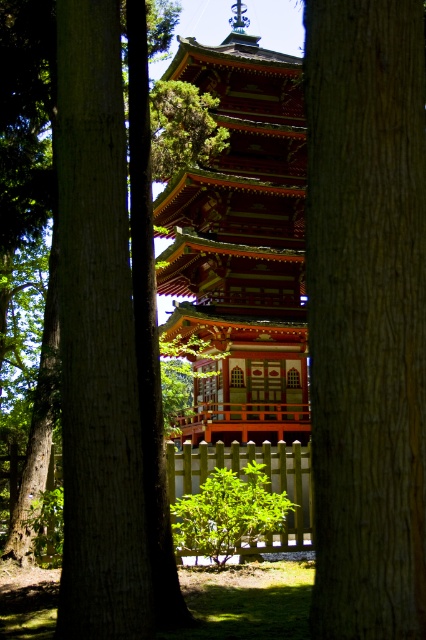
Which of these two, brown rough tree trunk at center or shiny lacquered pagoda at center, stands taller?

Standing taller between the two is shiny lacquered pagoda at center.

Does point (406, 321) come behind point (261, 77)?

No, (406, 321) is closer to viewer.

Is point (351, 620) less distant than point (261, 100)?

Yes, point (351, 620) is closer to viewer.

You are a GUI agent. You are given a task and a screenshot of the screen. Output one action in this format:
    pyautogui.click(x=<x>, y=<y>)
    Task: Click on the brown rough tree trunk at center
    
    Given the screenshot: What is the action you would take?
    pyautogui.click(x=365, y=314)

Is brown rough tree trunk at center shorter than smooth brown tree trunk at center?

Indeed, brown rough tree trunk at center has a lesser height compared to smooth brown tree trunk at center.

Does brown rough tree trunk at center have a greater height compared to smooth brown tree trunk at center?

No.

Is point (307, 296) positioned behind point (71, 484)?

No, (307, 296) is in front of (71, 484).

What are the coordinates of `brown rough tree trunk at center` in the screenshot? It's located at (365, 314).

Does smooth brown tree trunk at center have a greater height compared to shiny lacquered pagoda at center?

Incorrect, smooth brown tree trunk at center's height is not larger of shiny lacquered pagoda at center's.

Between smooth brown tree trunk at center and shiny lacquered pagoda at center, which one is positioned lower?

smooth brown tree trunk at center is below.

Between point (80, 179) and point (170, 192), which one is positioned behind?

Positioned behind is point (170, 192).

Image resolution: width=426 pixels, height=640 pixels. I want to click on smooth brown tree trunk at center, so click(x=106, y=342).